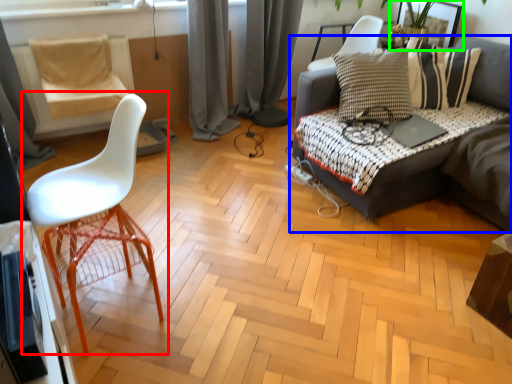
Question: Which object is positioned farthest from chair (highlighted by a red box)? Select from studio couch (highlighted by a blue box) and picture frame (highlighted by a green box).

Choices:
 (A) studio couch
 (B) picture frame

Answer: (B)